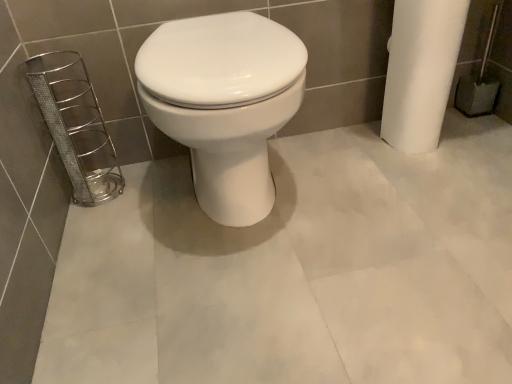
Where is `vacant area situated below white glossy toilet at center (from a real-world perspective)`? The image size is (512, 384). vacant area situated below white glossy toilet at center (from a real-world perspective) is located at coordinates (244, 218).